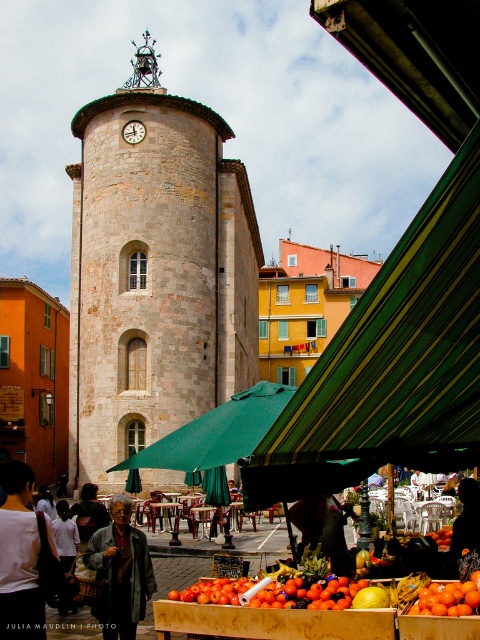
Question: Which point is farther from the camera taking this photo?

Choices:
 (A) (403, 362)
 (B) (132, 131)
 (C) (140, 609)

Answer: (B)

Question: From the image, what is the correct spatial relationship of white cotton shirt at center in relation to matte white clock at center?

Choices:
 (A) right
 (B) left

Answer: (A)

Question: Is stone clock tower at center smaller than matte white clock at center?

Choices:
 (A) yes
 (B) no

Answer: (B)

Question: Which of the following is the farthest from the observer?

Choices:
 (A) (32, 474)
 (B) (108, 595)

Answer: (A)

Question: Does stone clock tower at center appear on the right side of matte white clock at center?

Choices:
 (A) yes
 (B) no

Answer: (A)

Question: Among these objects, which one is farthest from the camera?

Choices:
 (A) white cotton shirt at center
 (B) green striped awning at center

Answer: (A)